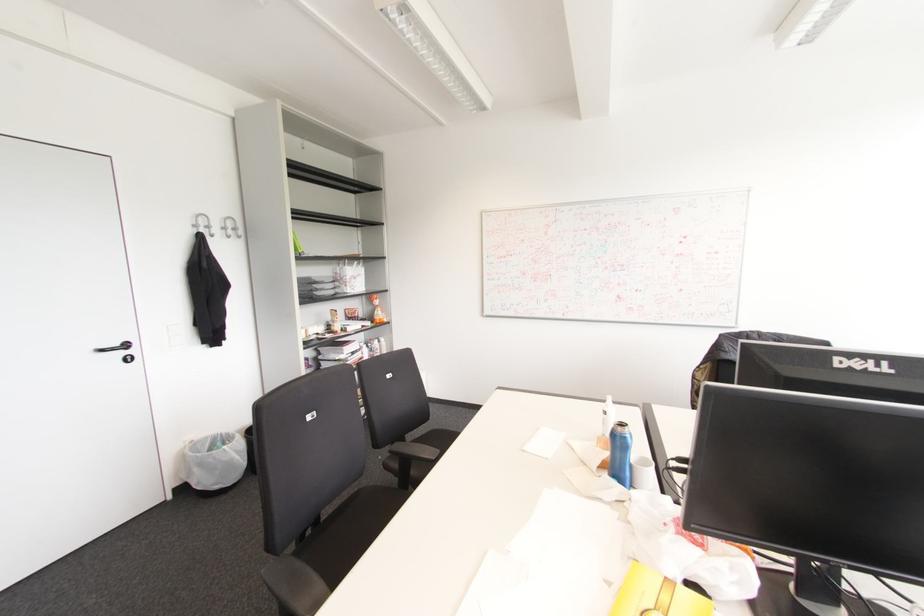
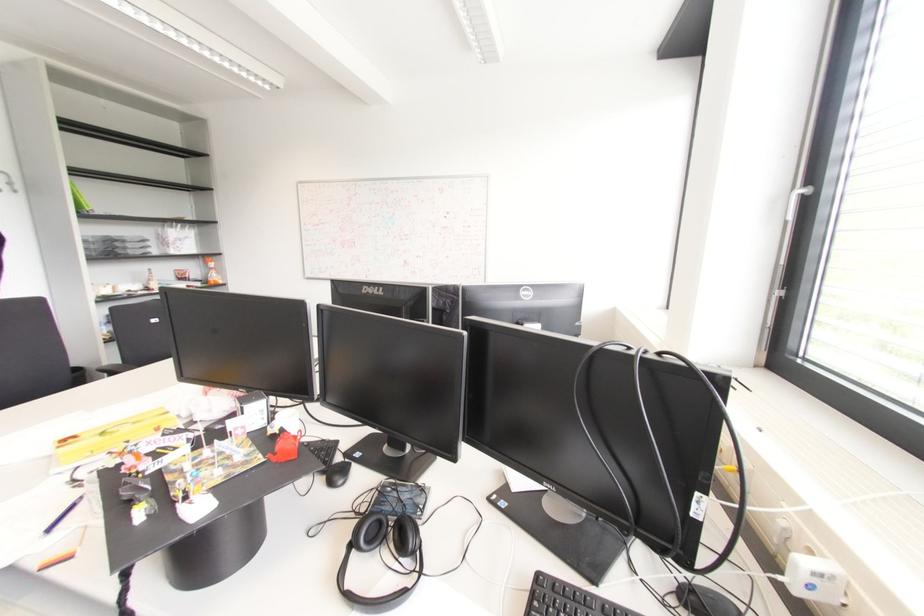
What movement of the cameraman would produce the second image?

The cameraman moved toward right, backward.